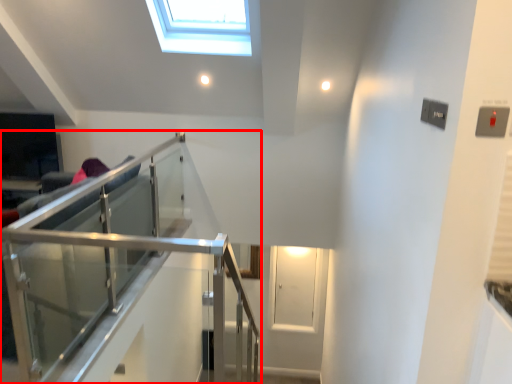
Question: Where is balcony (annotated by the red box) located in relation to glass door in the image?

Choices:
 (A) right
 (B) left

Answer: (B)